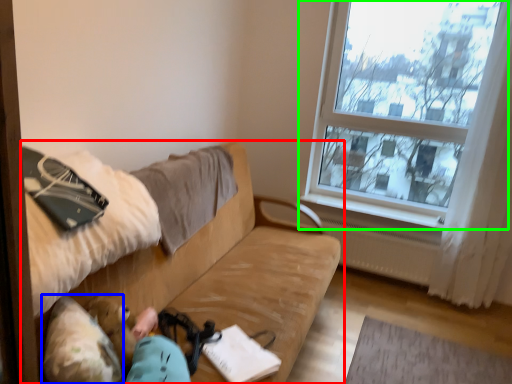
Question: Which is nearer to the studio couch (highlighted by a red box)? animal (highlighted by a blue box) or window (highlighted by a green box).

Choices:
 (A) animal
 (B) window

Answer: (A)